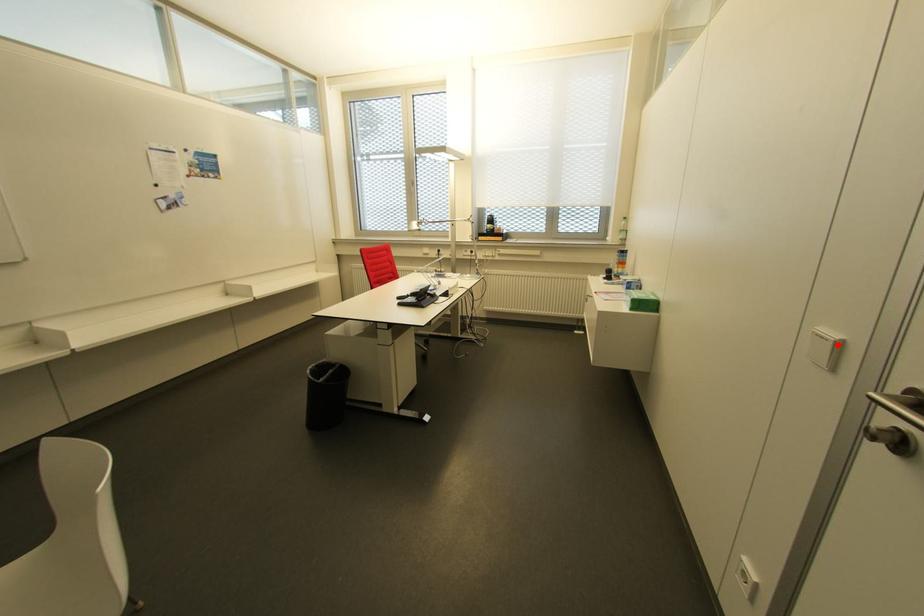
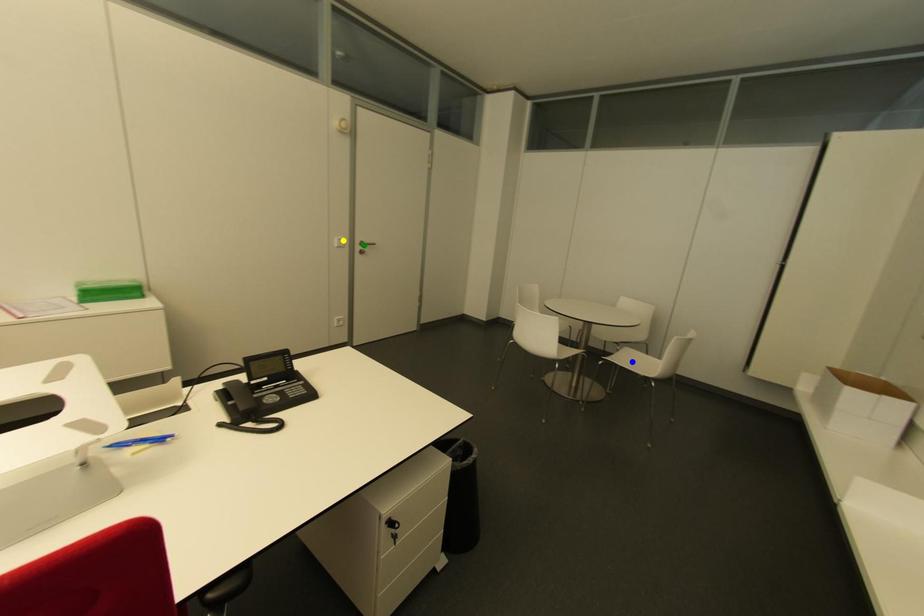
Question: I am providing you with two images of the same scene from different viewpoints. A red point is marked on the first image. You are given multiple points on the second image. Which mark in image 2 goes with the point in image 1?

Choices:
 (A) yellow point
 (B) blue point
 (C) green point

Answer: (A)